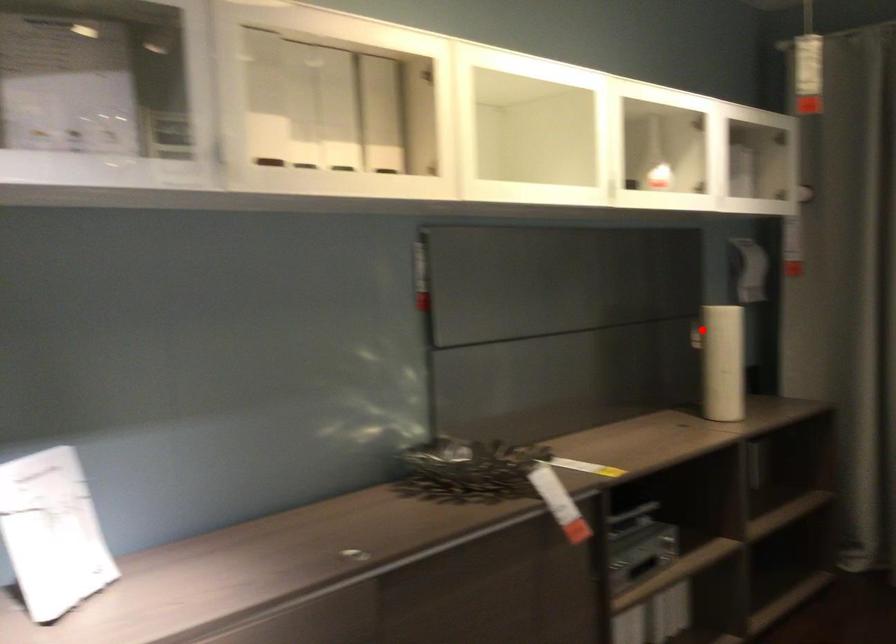
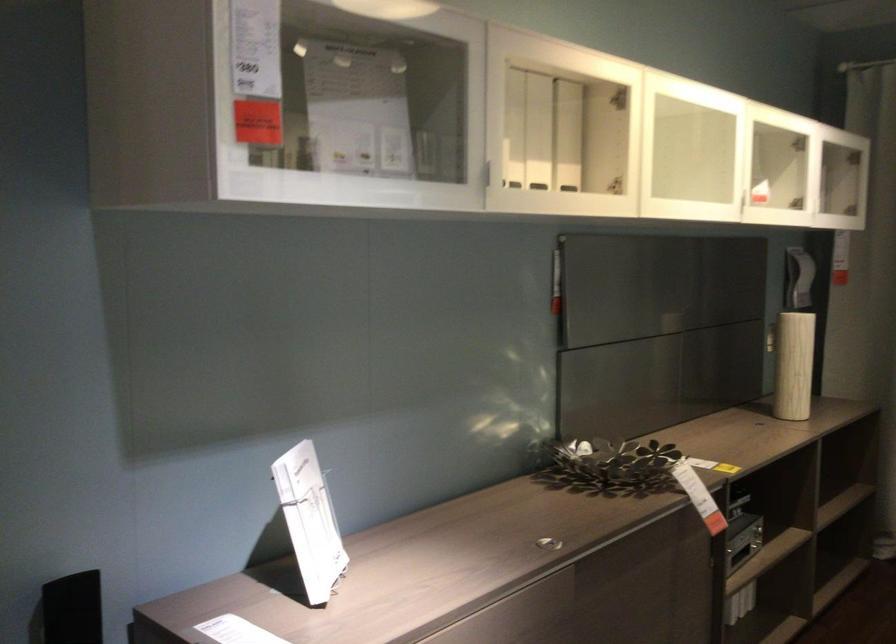
Question: I am providing you with two images of the same scene from different viewpoints. Given a red point in image1, look at the same physical point in image2. Is it:

Choices:
 (A) Closer to the viewpoint
 (B) Farther from the viewpoint

Answer: (B)